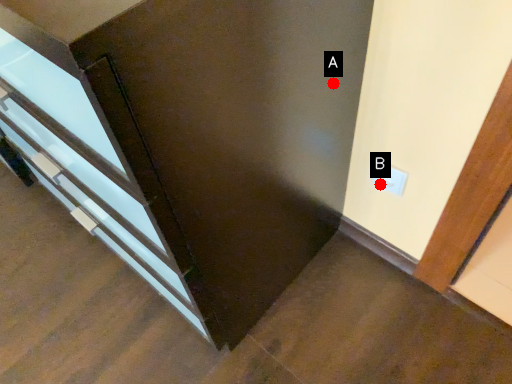
Question: Two points are circled on the image, labeled by A and B beside each circle. Which of the following is the farthest from the observer?

Choices:
 (A) A is further
 (B) B is further

Answer: (B)